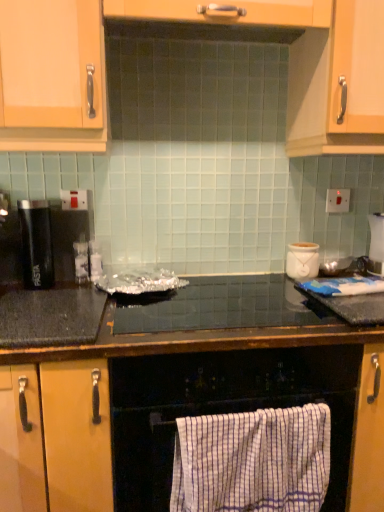
Question: Relative to white striped towel at lower center, is white checkered towel at lower center in front or behind?

Choices:
 (A) behind
 (B) front

Answer: (B)

Question: Based on their positions, is white checkered towel at lower center located to the left or right of white striped towel at lower center?

Choices:
 (A) right
 (B) left

Answer: (B)

Question: Based on their relative distances, which object is nearer to the white checkered towel at lower center?

Choices:
 (A) black granite countertop at center, which ranks as the 1th countertop in bottom-to-top order
 (B) black matte pasta container at left
 (C) black glossy countertop at center, the first countertop viewed from the top
 (D) white striped towel at lower center
 (E) white ceramic pot at upper right

Answer: (A)

Question: Which of these objects is positioned closest to the white ceramic pot at upper right?

Choices:
 (A) white striped towel at lower center
 (B) black granite countertop at center, which ranks as the 1th countertop in bottom-to-top order
 (C) white checkered towel at lower center
 (D) black matte pasta container at left
 (E) black glossy countertop at center, the first countertop viewed from the top

Answer: (E)